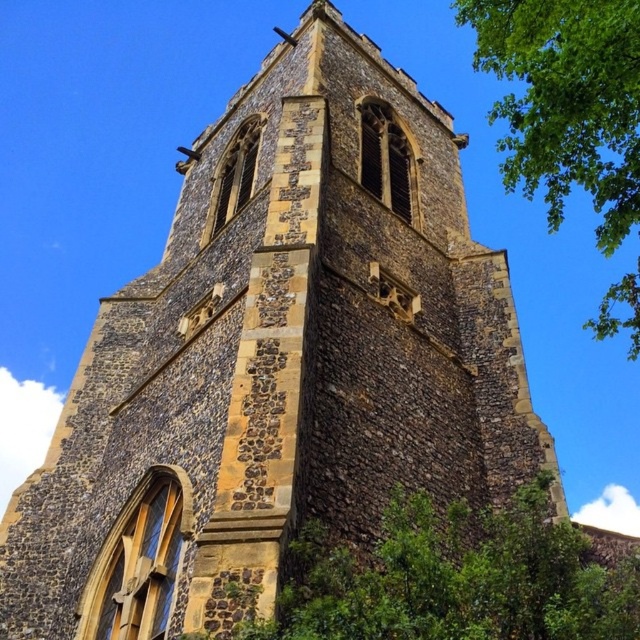
Question: From the image, what is the correct spatial relationship of green leafy tree at center in relation to green leafy tree at upper right?

Choices:
 (A) above
 (B) below

Answer: (B)

Question: Which of the following is the farthest from the observer?

Choices:
 (A) (632, 227)
 (B) (490, 532)

Answer: (A)

Question: Can you confirm if green leafy tree at center is positioned to the right of green leafy tree at upper right?

Choices:
 (A) yes
 (B) no

Answer: (B)

Question: Which of the following is the closest to the observer?

Choices:
 (A) green leafy tree at upper right
 (B) green leafy tree at center

Answer: (B)

Question: Is the position of green leafy tree at center less distant than that of green leafy tree at upper right?

Choices:
 (A) yes
 (B) no

Answer: (A)